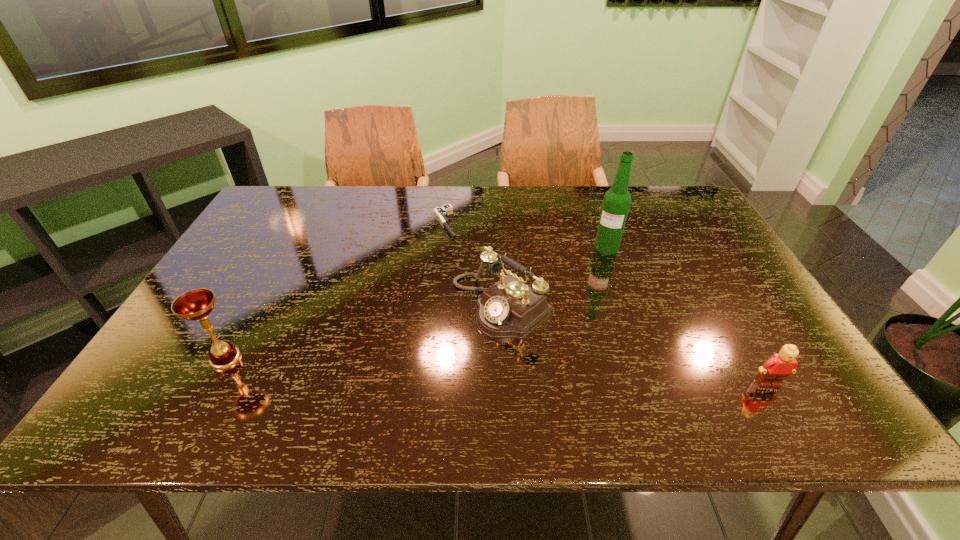
At what (x,y) coordinates should I click in order to perform the action: click on free region at the far left corner of the desktop. Please return your answer as a coordinate pair (x, y). The image size is (960, 540). Looking at the image, I should click on (321, 186).

This screenshot has height=540, width=960. Identify the location of vacant space at the near left corner. (219, 373).

Where is `free space at the far right corner of the desktop`? The image size is (960, 540). free space at the far right corner of the desktop is located at coordinates (662, 195).

The image size is (960, 540). Identify the location of free space at the near right corner of the desktop. (755, 357).

This screenshot has height=540, width=960. I want to click on vacant space in between the telephone and the Lego, so click(636, 344).

Find the location of a particular element. Image resolution: width=960 pixels, height=540 pixels. unoccupied position between the telephone and the shortest object is located at coordinates (473, 264).

Where is `free space between the fourth farthest object and the third nearest object`? The height and width of the screenshot is (540, 960). free space between the fourth farthest object and the third nearest object is located at coordinates pyautogui.click(x=364, y=332).

At what (x,y) coordinates should I click in order to perform the action: click on free space between the nearest object and the leftmost object. Please return your answer as a coordinate pair (x, y). Looking at the image, I should click on (497, 371).

At what (x,y) coordinates should I click in order to perform the action: click on free space between the chalice and the fourth tallest object. Please return your answer as a coordinate pair (x, y). The width and height of the screenshot is (960, 540). Looking at the image, I should click on (497, 371).

Find the location of a particular element. The height and width of the screenshot is (540, 960). vacant space in between the pistol and the Lego is located at coordinates (607, 303).